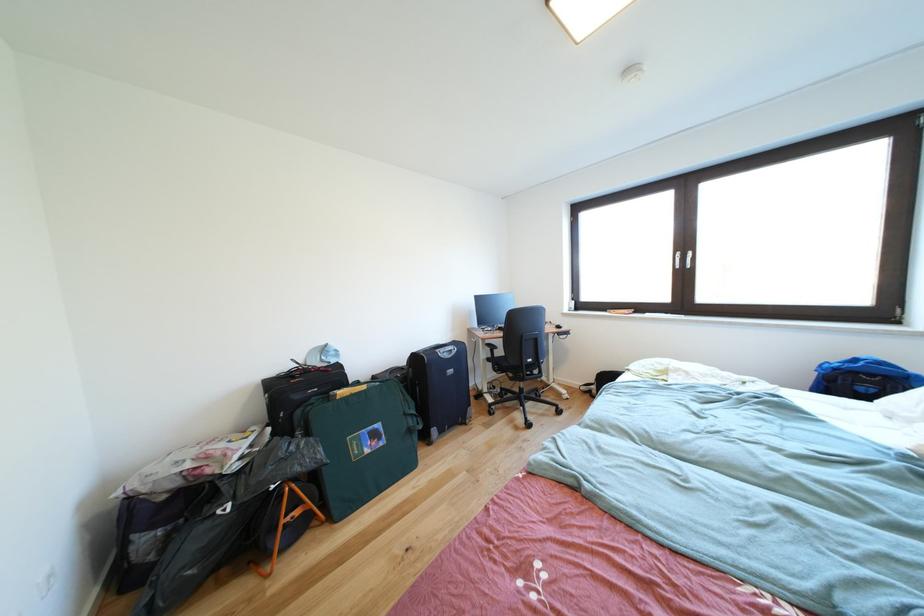
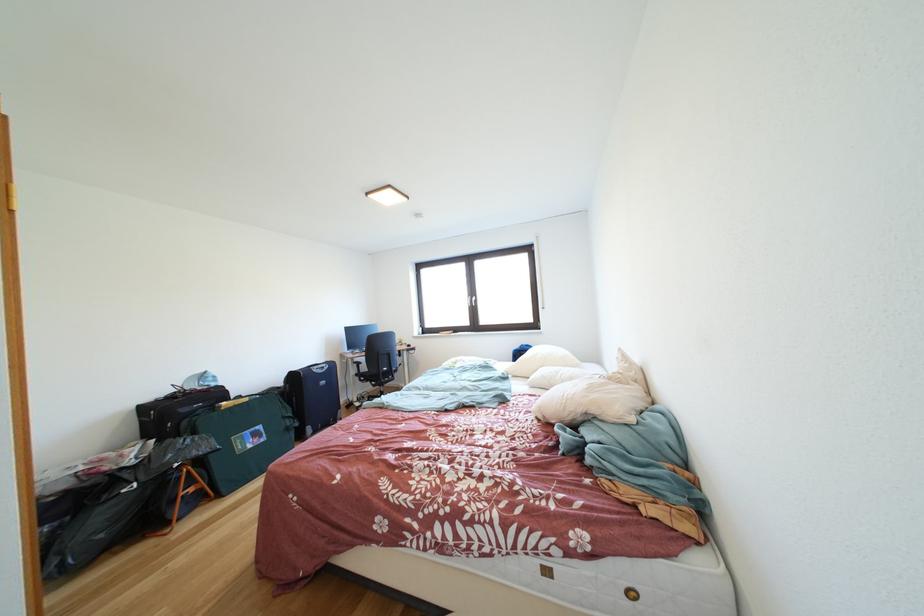
Locate, in the second image, the point that corresponds to the point at 342,365 in the first image.

(222, 389)